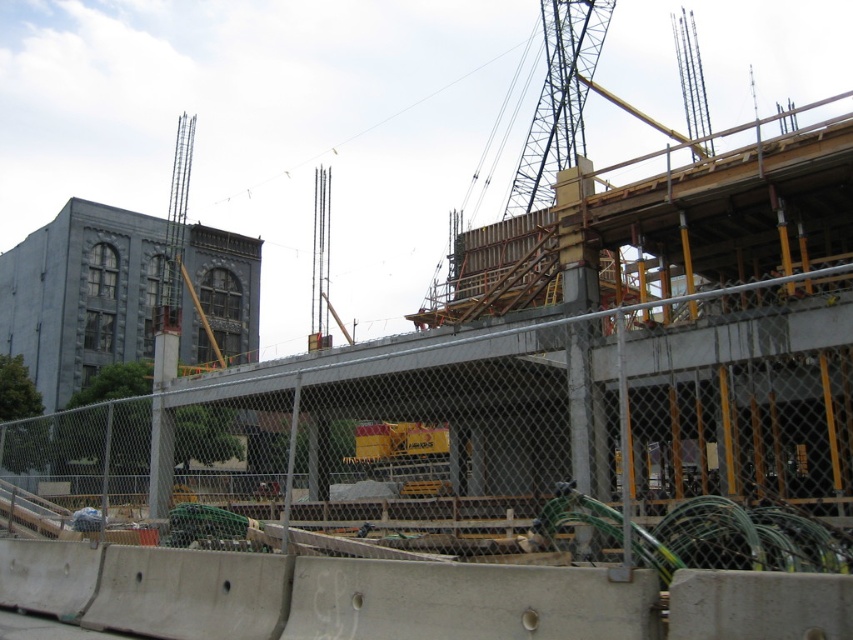
You are a safety inspector standing at the edge of a construction site. You need to ensure that the metal mesh fence at center is at least 20 meters away from the public area to comply with safety regulations. Based on the image, is the fence compliant?

The metal mesh fence at center is 20.01 meters away from the viewer, which meets the minimum 20 meters requirement. Therefore, it is compliant with safety regulations.

You are standing at the point closest to the viewer in the construction site image. Which point, point (370, 408) or point (520, 156), are you standing at?

You are standing at point (370, 408) because it is in front of point (520, 156).

You are standing at the origin point of the image coordinate system. Which direction should you move to reach the metal mesh fence at center?

The metal mesh fence at center is located at point 0.673 in the x direction and 0.557 in the y direction. Since you are at the origin, you should move towards the positive x and positive y directions to reach it.